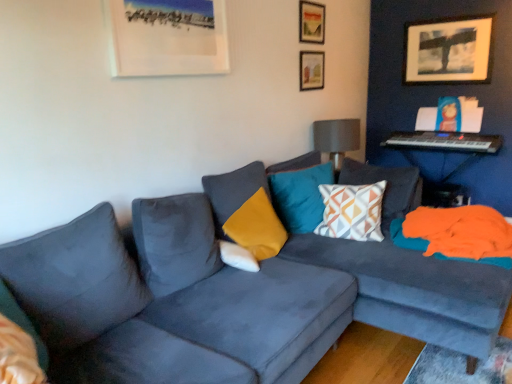
Question: From their relative heights in the image, would you say geometric-patterned fabric pillow at center, the first pillow from the right, is taller or shorter than metallic silver keyboard at upper right?

Choices:
 (A) short
 (B) tall

Answer: (B)

Question: Considering the positions of point (376, 203) and point (425, 135), is point (376, 203) closer or farther from the camera than point (425, 135)?

Choices:
 (A) closer
 (B) farther

Answer: (A)

Question: Estimate the real-world distances between objects in this image. Which object is closer to the wooden picture frame at upper right, which is the 1th picture frame in right-to-left order?

Choices:
 (A) teal velvet pillow at center, which is the 3th pillow from left to right
 (B) matte white picture frame at upper left, the 4th picture frame when ordered from back to front
 (C) matte gray lampshade at upper right
 (D) geometric-patterned fabric pillow at center, marked as the fourth pillow in a left-to-right arrangement
 (E) wooden picture frame at upper center, marked as the second picture frame in a right-to-left arrangement

Answer: (C)

Question: Considering the real-world distances, which object is farthest from the wooden picture frame at upper center, the 2th picture frame in the front-to-back sequence?

Choices:
 (A) wooden picture frame at upper center, the third picture frame viewed from the front
 (B) metallic silver keyboard at upper right
 (C) wooden picture frame at upper right, which is the 1th picture frame in right-to-left order
 (D) geometric-patterned fabric pillow at center, marked as the fourth pillow in a left-to-right arrangement
 (E) teal velvet pillow at center, the 2th pillow in the right-to-left sequence

Answer: (D)